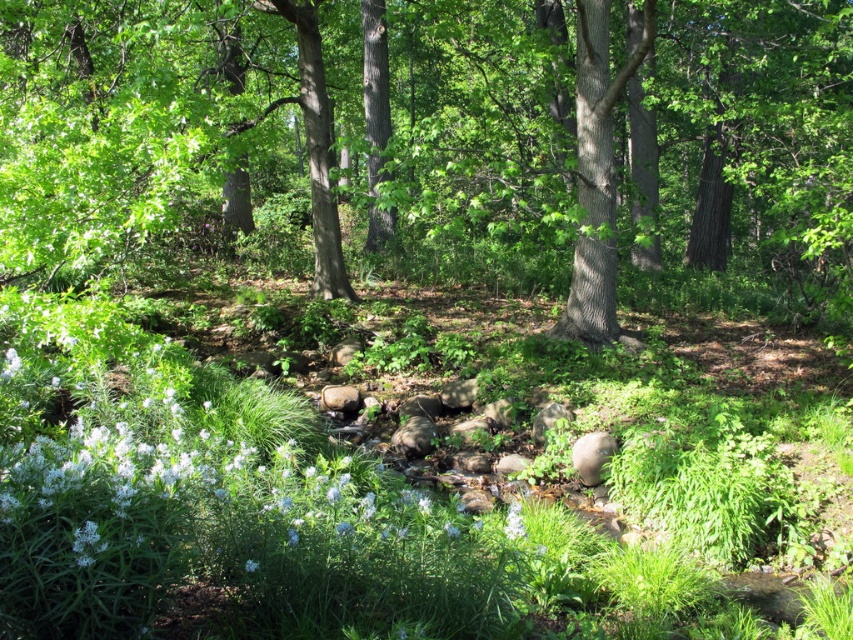
You are standing in the woodland scene and want to take a photo of both the green leafy tree at center and the smooth bark tree at center. Which tree should you focus on first to ensure both are in the frame?

You should focus on the green leafy tree at center first because it is closer to you than the smooth bark tree at center, allowing both to be captured in the frame.

What are the coordinates of the green leafy tree at center in the image?

The green leafy tree at center is located at coordinates 0.230 in the x axis and 0.515 in the y axis.